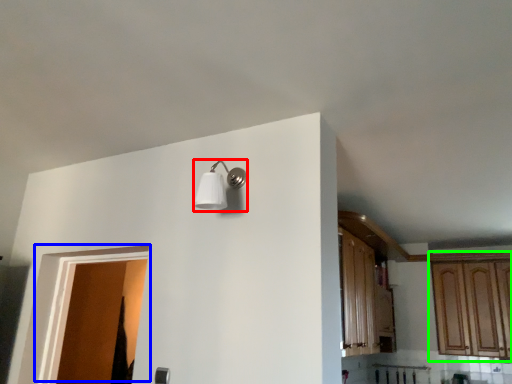
Question: Based on their relative distances, which object is nearer to light fixture (highlighted by a red box)? Choose from door (highlighted by a blue box) and cabinetry (highlighted by a green box).

Choices:
 (A) door
 (B) cabinetry

Answer: (A)